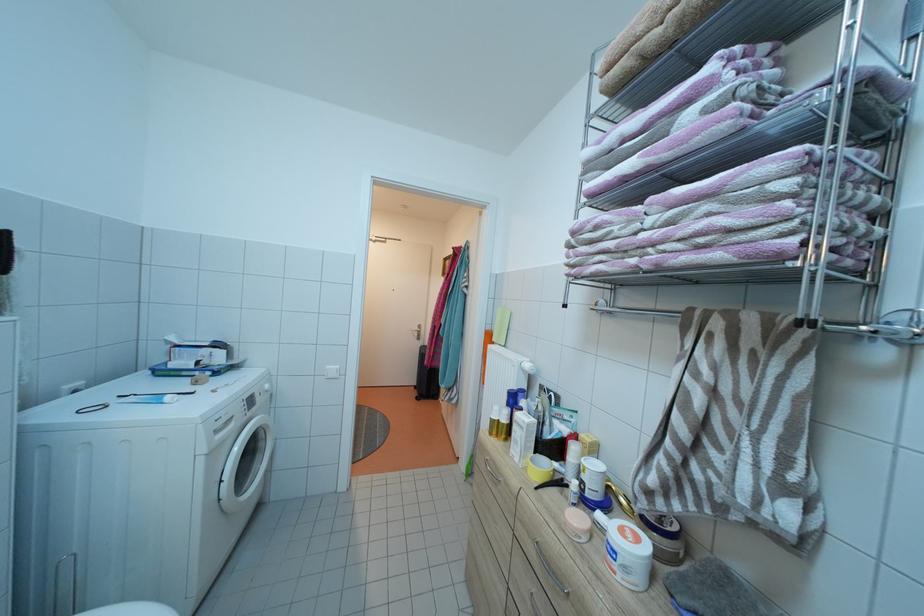
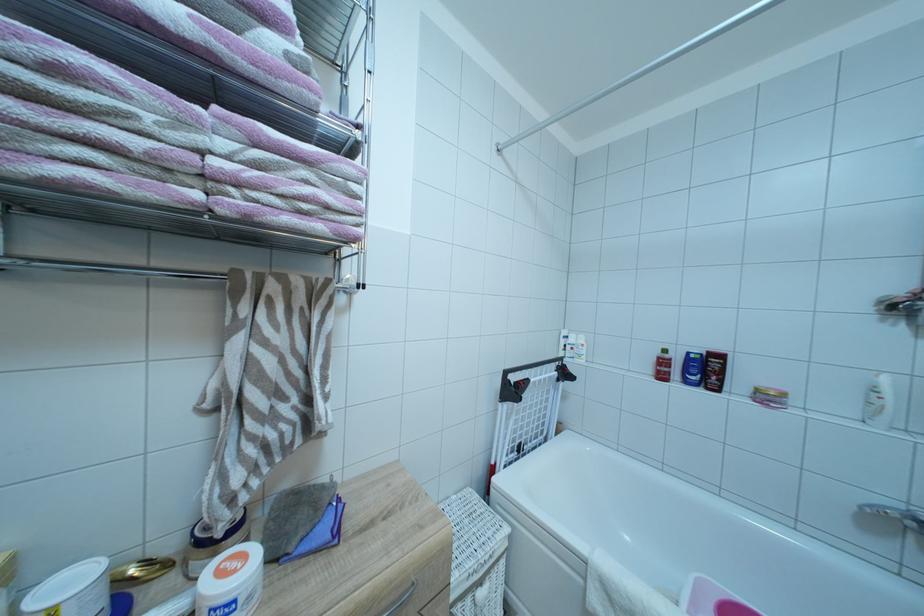
Question: The camera is either moving clockwise (left) or counter-clockwise (right) around the object. The first image is from the beginning of the video and the second image is from the end. Is the camera moving left or right when shooting the video?

Choices:
 (A) Left
 (B) Right

Answer: (A)